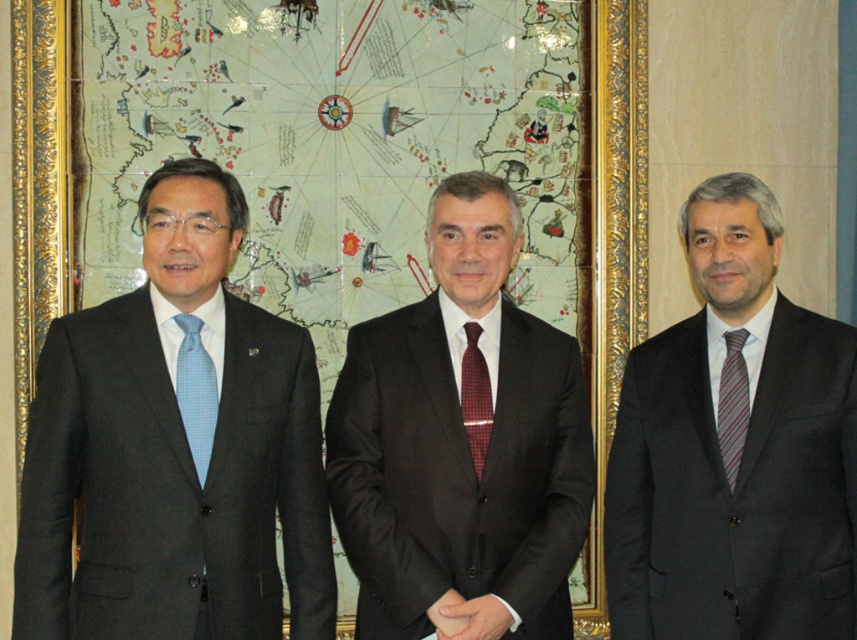
Is point (772, 580) more distant than point (472, 349)?

No.

What do you see at coordinates (734, 449) in the screenshot?
I see `dark gray suit at right` at bounding box center [734, 449].

Is point (742, 268) in front of point (463, 394)?

Yes, point (742, 268) is closer to viewer.

Where is `dark gray suit at right`? The image size is (857, 640). dark gray suit at right is located at coordinates (734, 449).

The width and height of the screenshot is (857, 640). What do you see at coordinates (460, 445) in the screenshot?
I see `dark gray suit at center` at bounding box center [460, 445].

Which is behind, point (505, 609) or point (177, 323)?

Positioned behind is point (505, 609).

Is point (573, 552) positioned after point (190, 417)?

Yes, it is behind point (190, 417).

At what (x,y) coordinates should I click in order to perform the action: click on dark gray suit at center. Please return your answer as a coordinate pair (x, y). Image resolution: width=857 pixels, height=640 pixels. Looking at the image, I should click on [x=460, y=445].

Looking at this image, is gold-framed picture at center below striped silk tie at right?

No.

Between gold-framed picture at center and striped silk tie at right, which one has more height?

With more height is gold-framed picture at center.

At what (x,y) coordinates should I click in order to perform the action: click on gold-framed picture at center. Please return your answer as a coordinate pair (x, y). Looking at the image, I should click on (285, 292).